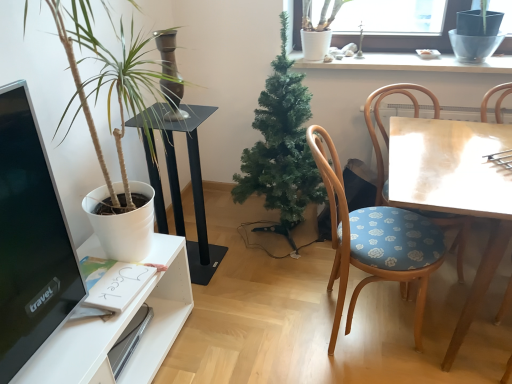
I want to click on free spot to the left of green artificial tree at center, which is counted as the 1th houseplant, starting from the right, so click(225, 244).